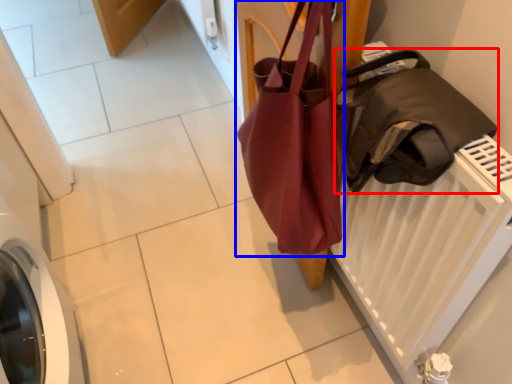
Question: Among these objects, which one is nearest to the camera, luggage and bags (highlighted by a red box) or handbag (highlighted by a blue box)?

Choices:
 (A) luggage and bags
 (B) handbag

Answer: (A)